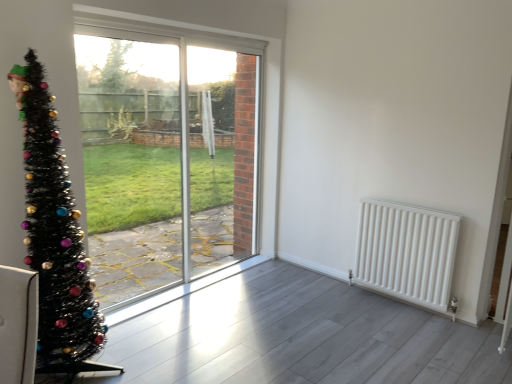
Where is `unoccupied region to the right of transparent glass window at center`? unoccupied region to the right of transparent glass window at center is located at coordinates (269, 296).